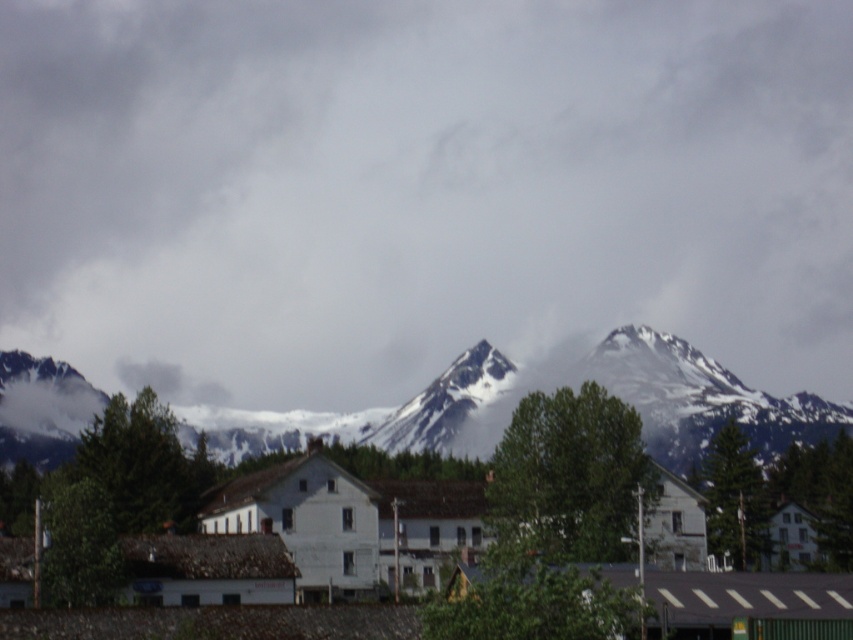
Can you confirm if cloudy sky at upper center is taller than snowy rock mountain at center?

Yes, cloudy sky at upper center is taller than snowy rock mountain at center.

Which of these two, cloudy sky at upper center or snowy rock mountain at center, stands taller?

cloudy sky at upper center

The width and height of the screenshot is (853, 640). In order to click on cloudy sky at upper center in this screenshot , I will do (x=421, y=188).

You are a GUI agent. You are given a task and a screenshot of the screen. Output one action in this format:
    pyautogui.click(x=<x>, y=<y>)
    Task: Click on the cloudy sky at upper center
    The width and height of the screenshot is (853, 640).
    Given the screenshot: What is the action you would take?
    pyautogui.click(x=421, y=188)